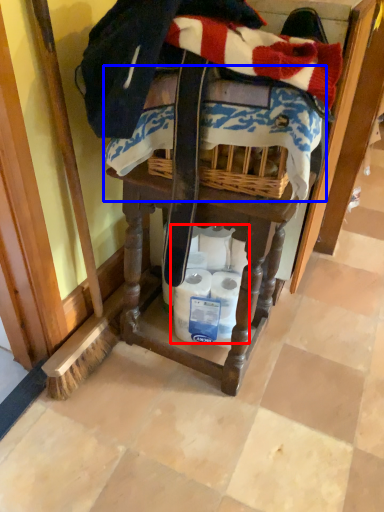
Question: Among these objects, which one is nearest to the camera, toilet paper (highlighted by a red box) or underclothes (highlighted by a blue box)?

Choices:
 (A) toilet paper
 (B) underclothes

Answer: (B)